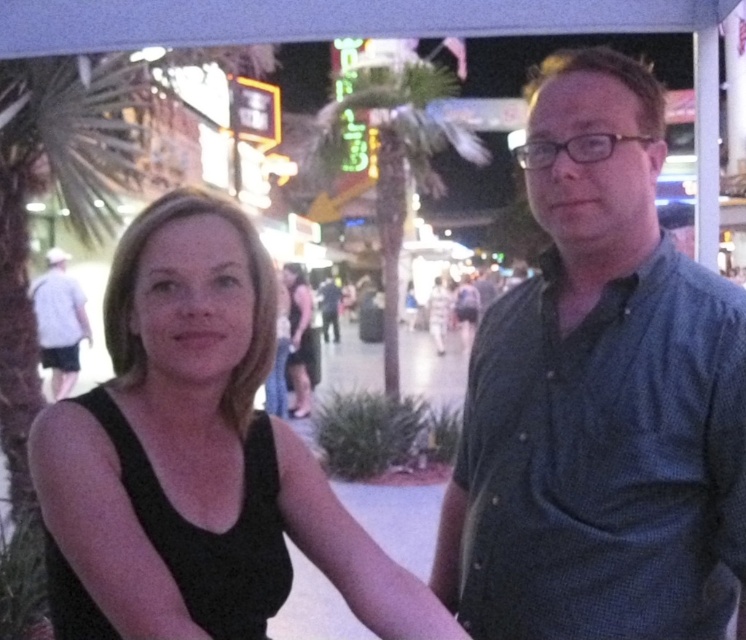
You are a photographer trying to capture a photo of the black matte tank top at center and the green leafy palm tree at center in the image. Which object is shorter in the scene?

The black matte tank top at center is shorter than the green leafy palm tree at center.

You are standing at the point with coordinates point (54, 385) and want to move to the point with coordinates point (709, 513). Based on the scene description, will you have to walk past any obstacles or people along the way?

Point (709, 513) is in front of point (54, 385), so you will not have to walk past any obstacles or people along the way.